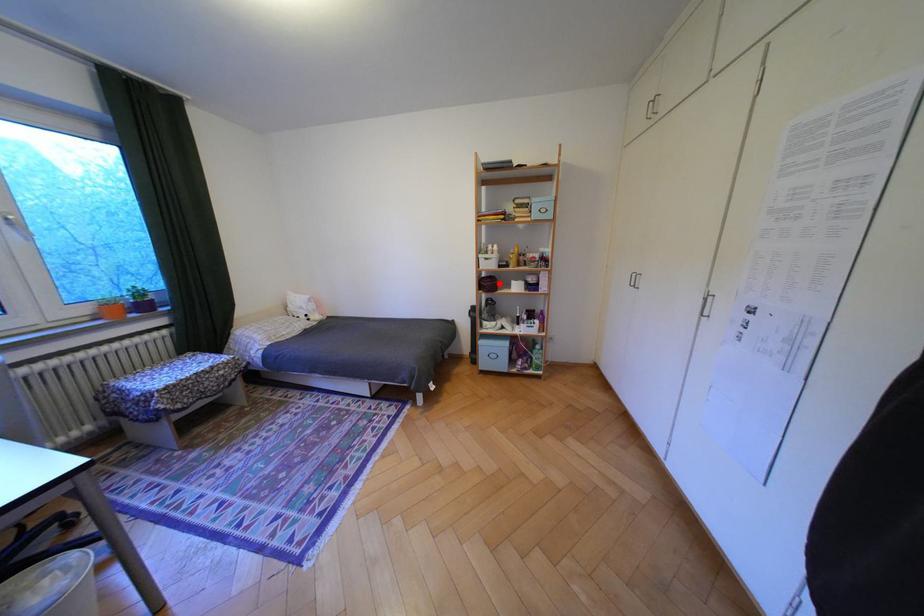
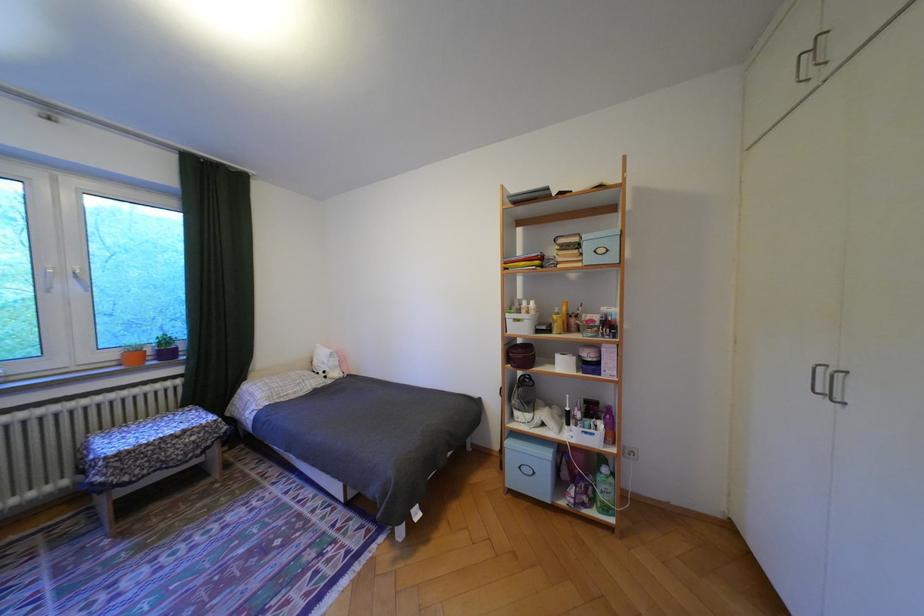
Find the pixel in the second image that matches the highlighted location in the first image.

(531, 355)